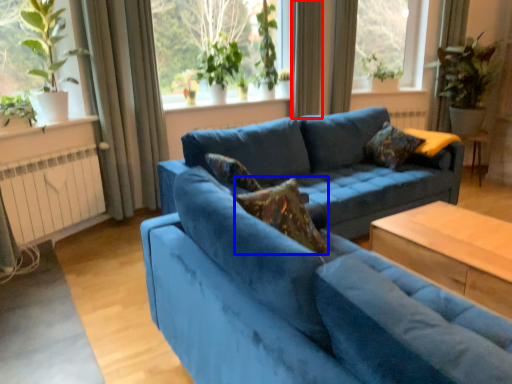
Question: Among these objects, which one is farthest to the camera, curtain (highlighted by a red box) or pillow (highlighted by a blue box)?

Choices:
 (A) curtain
 (B) pillow

Answer: (A)